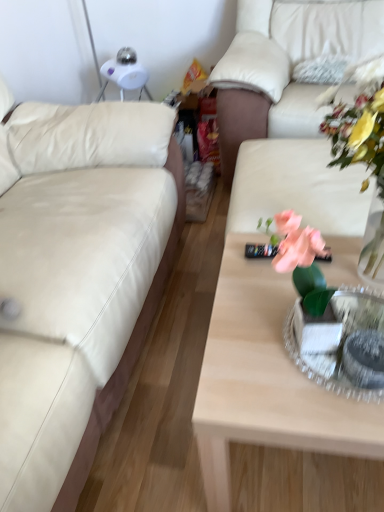
Describe the element at coordinates (265, 381) in the screenshot. I see `light wood coffee table at center` at that location.

What do you see at coordinates (340, 342) in the screenshot? I see `metallic silver tray at center` at bounding box center [340, 342].

What do you see at coordinates (360, 124) in the screenshot? This screenshot has width=384, height=512. I see `translucent glass vase at upper right` at bounding box center [360, 124].

I want to click on white leather couch at upper right, which appears as the first studio couch when viewed from the right, so click(x=284, y=65).

The width and height of the screenshot is (384, 512). What do you see at coordinates (284, 65) in the screenshot? I see `white leather couch at upper right, which is the second studio couch in left-to-right order` at bounding box center [284, 65].

Identify the location of light wood coffee table at center. The height and width of the screenshot is (512, 384). (265, 381).

From a real-world perspective, is metallic silver tray at center positioned above or below light wood coffee table at center?

In terms of real-world spatial position, metallic silver tray at center is above light wood coffee table at center.

Identify the location of coffee table below the metallic silver tray at center (from the image's perspective). pos(265,381).

From the image's perspective, is metallic silver tray at center on top of light wood coffee table at center?

Yes.

In terms of width, does metallic silver tray at center look wider or thinner when compared to light wood coffee table at center?

Clearly, metallic silver tray at center has less width compared to light wood coffee table at center.

Who is smaller, light wood coffee table at center or white textured pillow at upper right?

Smaller between the two is white textured pillow at upper right.

From a real-world perspective, is light wood coffee table at center above or below white textured pillow at upper right?

From a real-world perspective, light wood coffee table at center is physically below white textured pillow at upper right.

Consider the image. Considering the relative positions of light wood coffee table at center and white textured pillow at upper right in the image provided, is light wood coffee table at center to the right of white textured pillow at upper right from the viewer's perspective?

In fact, light wood coffee table at center is to the left of white textured pillow at upper right.

From the picture: Can you tell me how much light wood coffee table at center and white textured pillow at upper right differ in facing direction?

91.7 degrees.

Is beige leather couch at left, the 2th studio couch from the right, looking in the opposite direction of white leather couch at upper right, which is the second studio couch in left-to-right order?

beige leather couch at left, the 2th studio couch from the right, is not turned away from white leather couch at upper right, which is the second studio couch in left-to-right order.

Who is taller, beige leather couch at left, the 2th studio couch from the right, or white leather couch at upper right, which is the second studio couch in left-to-right order?

beige leather couch at left, the 2th studio couch from the right, is taller.

Is beige leather couch at left, the 2th studio couch from the right, bigger or smaller than white leather couch at upper right, which appears as the first studio couch when viewed from the right?

In the image, beige leather couch at left, the 2th studio couch from the right, appears to be larger than white leather couch at upper right, which appears as the first studio couch when viewed from the right.

Considering the relative positions of beige leather couch at left, the 1th studio couch from the left, and white leather couch at upper right, which is the second studio couch in left-to-right order, in the image provided, is beige leather couch at left, the 1th studio couch from the left, in front of white leather couch at upper right, which is the second studio couch in left-to-right order,?

Yes, it is in front of white leather couch at upper right, which is the second studio couch in left-to-right order.

Is white textured pillow at upper right next to metallic silver tray at center and touching it?

No, white textured pillow at upper right is not next to metallic silver tray at center.

Can you tell me how much white textured pillow at upper right and metallic silver tray at center differ in facing direction?

The facing directions of white textured pillow at upper right and metallic silver tray at center are 88.5 degrees apart.

From a real-world perspective, between white textured pillow at upper right and metallic silver tray at center, who is vertically lower?

metallic silver tray at center.

From the image's perspective, which is above, white textured pillow at upper right or metallic silver tray at center?

white textured pillow at upper right.

Identify the location of tableware located on the right of beige leather couch at left, the 1th studio couch from the left. (340, 342).

Based on the photo, between metallic silver tray at center and beige leather couch at left, the 1th studio couch from the left, which one has smaller size?

Smaller between the two is metallic silver tray at center.

Is metallic silver tray at center closer to camera compared to beige leather couch at left, the 1th studio couch from the left?

No, the depth of metallic silver tray at center is greater than that of beige leather couch at left, the 1th studio couch from the left.

Is metallic silver tray at center directly adjacent to beige leather couch at left, the 1th studio couch from the left?

No.

The width and height of the screenshot is (384, 512). There is a light wood coffee table at center. Identify the location of the 1st studio couch above it (from a real-world perspective). (284, 65).

From the image's perspective, would you say white leather couch at upper right, which appears as the first studio couch when viewed from the right, is positioned over light wood coffee table at center?

Yes, from the image's perspective, white leather couch at upper right, which appears as the first studio couch when viewed from the right, is on top of light wood coffee table at center.

Considering the relative sizes of white leather couch at upper right, which appears as the first studio couch when viewed from the right, and light wood coffee table at center in the image provided, is white leather couch at upper right, which appears as the first studio couch when viewed from the right, taller than light wood coffee table at center?

Yes, white leather couch at upper right, which appears as the first studio couch when viewed from the right, is taller than light wood coffee table at center.

Would you say white leather couch at upper right, which appears as the first studio couch when viewed from the right, contains light wood coffee table at center?

Definitely not — light wood coffee table at center is not inside white leather couch at upper right, which appears as the first studio couch when viewed from the right.

Is beige leather couch at left, the 2th studio couch from the right, positioned with its back to light wood coffee table at center?

No, beige leather couch at left, the 2th studio couch from the right,'s orientation is not away from light wood coffee table at center.

From their relative heights in the image, would you say beige leather couch at left, the 2th studio couch from the right, is taller or shorter than light wood coffee table at center?

Considering their sizes, beige leather couch at left, the 2th studio couch from the right, has more height than light wood coffee table at center.

You are a GUI agent. You are given a task and a screenshot of the screen. Output one action in this format:
    pyautogui.click(x=<x>, y=<y>)
    Task: Click on the coffee table on the right of beige leather couch at left, the 2th studio couch from the right
    
    Given the screenshot: What is the action you would take?
    pyautogui.click(x=265, y=381)

I want to click on tableware on the right of light wood coffee table at center, so click(x=340, y=342).

I want to click on coffee table located in front of the white textured pillow at upper right, so coord(265,381).

Considering their positions, is metallic silver tray at center positioned further to white textured pillow at upper right than white leather couch at upper right, which appears as the first studio couch when viewed from the right?

Among the two, metallic silver tray at center is located further to white textured pillow at upper right.

Estimate the real-world distances between objects in this image. Which object is closer to light wood coffee table at center, metallic silver tray at center or white textured pillow at upper right?

Based on the image, metallic silver tray at center appears to be nearer to light wood coffee table at center.

When comparing their distances from white textured pillow at upper right, does light wood coffee table at center or white leather couch at upper right, which is the second studio couch in left-to-right order, seem further?

The object further to white textured pillow at upper right is light wood coffee table at center.

Based on their spatial positions, is beige leather couch at left, the 2th studio couch from the right, or metallic silver tray at center further from translucent glass vase at upper right?

beige leather couch at left, the 2th studio couch from the right, lies further to translucent glass vase at upper right than the other object.

Based on their spatial positions, is translucent glass vase at upper right or beige leather couch at left, the 1th studio couch from the left, closer to white textured pillow at upper right?

The object closer to white textured pillow at upper right is translucent glass vase at upper right.

Considering their positions, is beige leather couch at left, the 1th studio couch from the left, positioned closer to metallic silver tray at center than translucent glass vase at upper right?

translucent glass vase at upper right.

Considering their positions, is translucent glass vase at upper right positioned further to light wood coffee table at center than beige leather couch at left, the 1th studio couch from the left?

beige leather couch at left, the 1th studio couch from the left, is further to light wood coffee table at center.

Based on their spatial positions, is light wood coffee table at center or translucent glass vase at upper right further from beige leather couch at left, the 1th studio couch from the left?

Among the two, translucent glass vase at upper right is located further to beige leather couch at left, the 1th studio couch from the left.

This screenshot has width=384, height=512. What are the coordinates of `coffee table located between beige leather couch at left, the 2th studio couch from the right, and white textured pillow at upper right in the depth direction` in the screenshot? It's located at (265, 381).

What are the coordinates of `floral arrangement between white leather couch at upper right, which is the second studio couch in left-to-right order, and light wood coffee table at center in the up-down direction` in the screenshot? It's located at (360, 124).

The height and width of the screenshot is (512, 384). In order to click on floral arrangement between beige leather couch at left, the 2th studio couch from the right, and white textured pillow at upper right in the front-back direction in this screenshot , I will do `click(360, 124)`.

In order to click on floral arrangement located between beige leather couch at left, the 1th studio couch from the left, and white leather couch at upper right, which appears as the first studio couch when viewed from the right, in the left-right direction in this screenshot , I will do `click(360, 124)`.